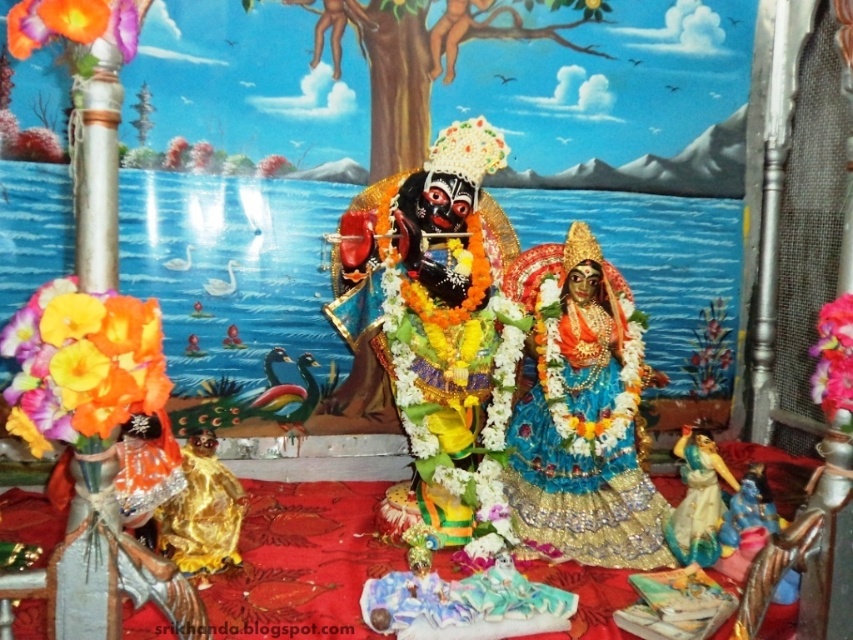
You are an assistant at the temple altar. You need to place a new offering between the blue silk saree at center and the floral garland at center. According to their positions, which object should the offering be placed to the left of?

The blue silk saree at center is positioned on the left side of floral garland at center, so the offering should be placed to the left of the floral garland at center.

You are standing in front of the Hindu temple altar and want to place a small offering exactly at the center of the polished gold statue at center. According to the coordinates provided, where should you place the offering?

The offering should be placed at the coordinates point (440, 332), which is the 2D location of the polished gold statue at center.

Based on the photo, you are an assistant at the temple altar and need to place a new offering. The offering requires placing an item taller than the blue silk saree at center. Can the polished gold statue at center be used for this purpose?

The polished gold statue at center has a greater height compared to the blue silk saree at center, so yes, it can be used as the offering since it is taller than the blue silk saree at center.